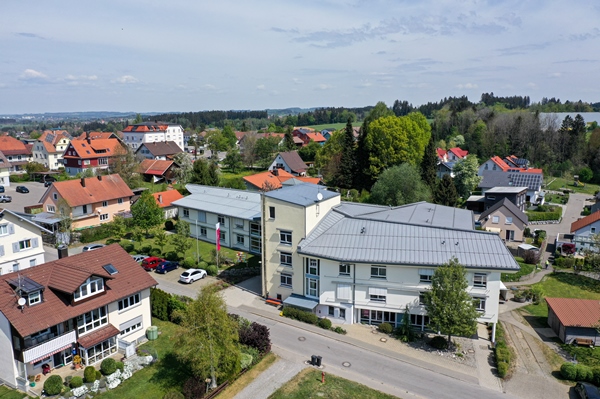
Where is `trash can`? This screenshot has height=399, width=600. trash can is located at coordinates (319, 359), (311, 359).